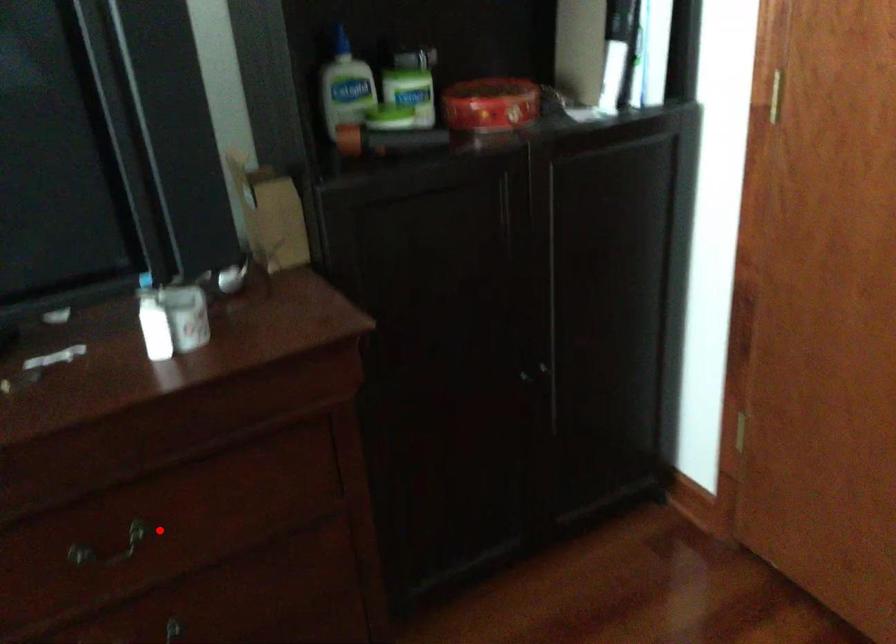
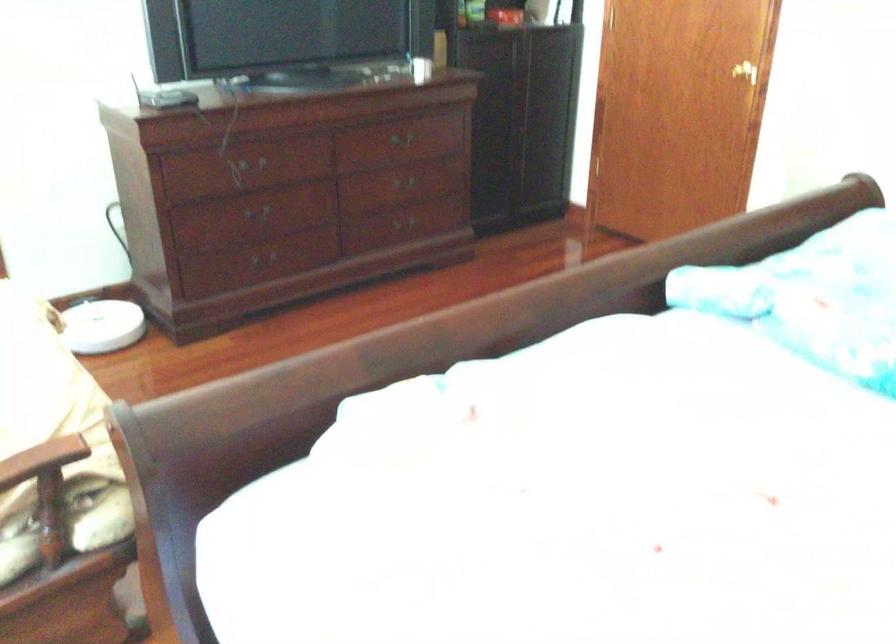
In the second image, find the point that corresponds to the highlighted location in the first image.

(401, 138)